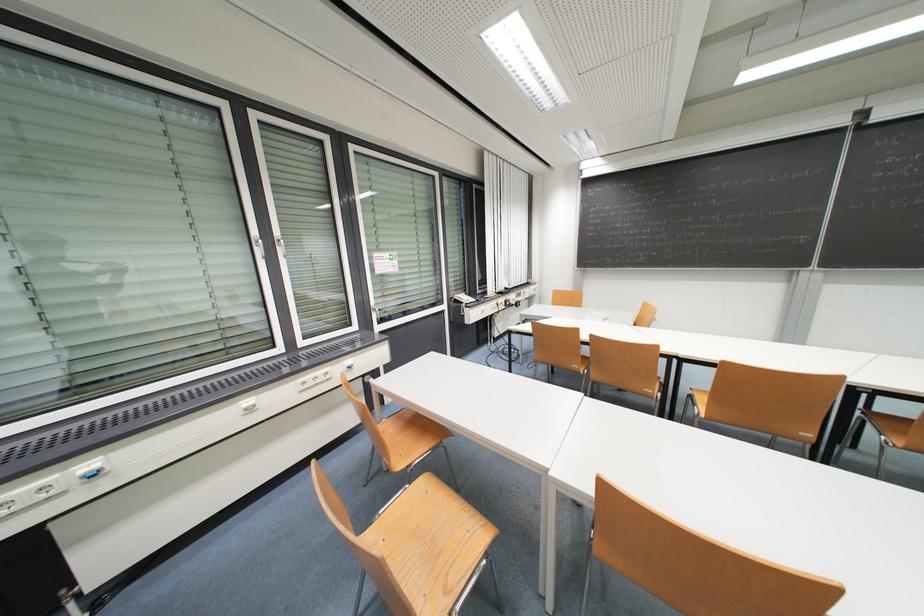
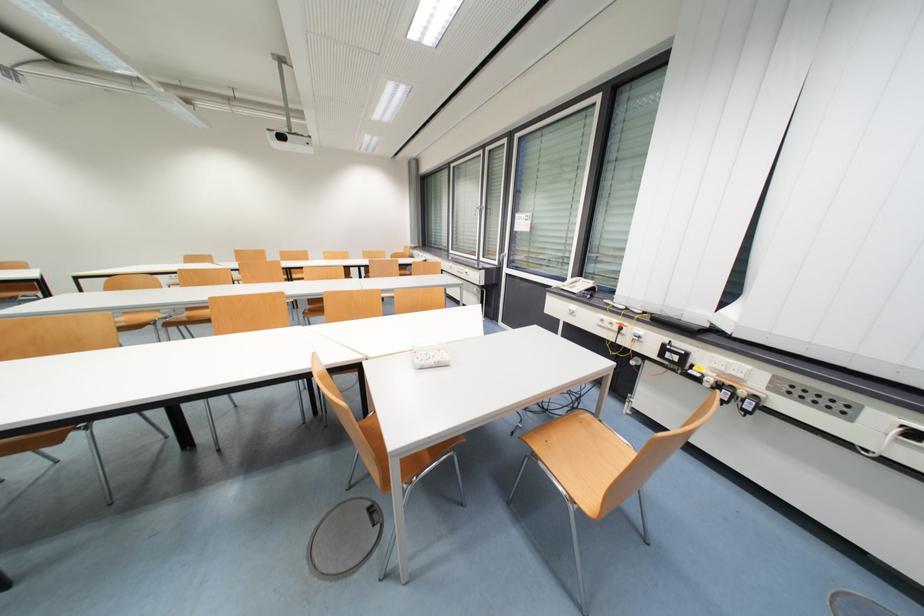
The point at (512, 304) is marked in the first image. Where is the corresponding point in the second image?

(671, 350)